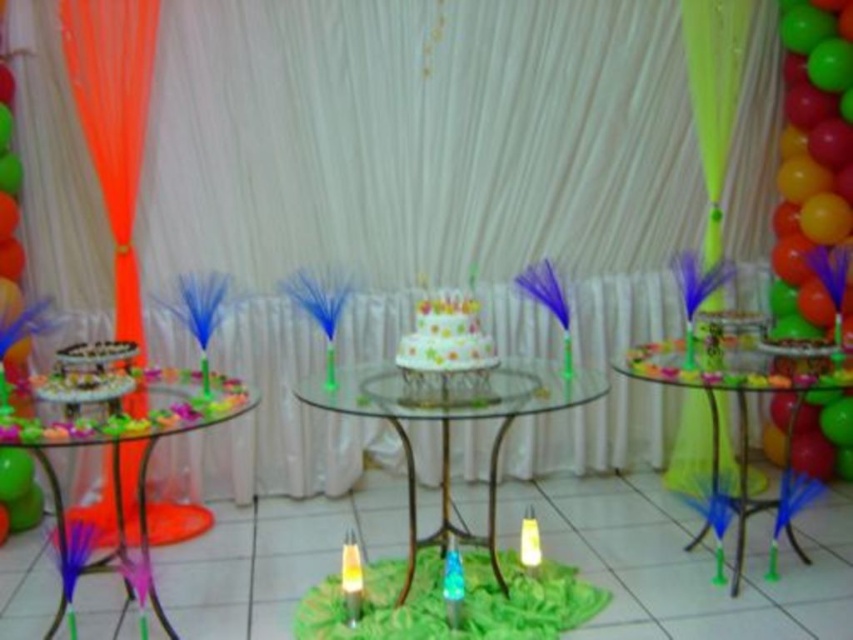
You are a guest at the party and want to blow out the white matte candle at center. To do this, you need to reach it from the white glossy cake at center. In which direction should you move relative to the cake to find the candle?

The white glossy cake at center is positioned on the left side of the white matte candle at center, so you should move to the right relative to the cake to find the candle.

You are standing at the point labeled point (x=73, y=387) and want to reach the central table with the multi tiered cake. The path between you and the central table is 2.29 meters long. If your walking speed is 1 meter per second, how many seconds will it take you to reach the central table?

The distance between you and the central table is 2.29 meters. Since you walk at 1 meter per second, it will take you 2.29 seconds to reach the central table.

You are planning to place a decorative candle that is 3 inches in diameter on the white glossy cake at center. The white matte candle at center is currently placed 29.28 inches away from the cake. Is there enough space between them to safely place the new candle without moving the existing candle?

The white glossy cake at center and white matte candle at center are 29.28 inches apart. Since the new candle is only 3 inches in diameter, there is ample space between them to place the new candle without moving the existing one.